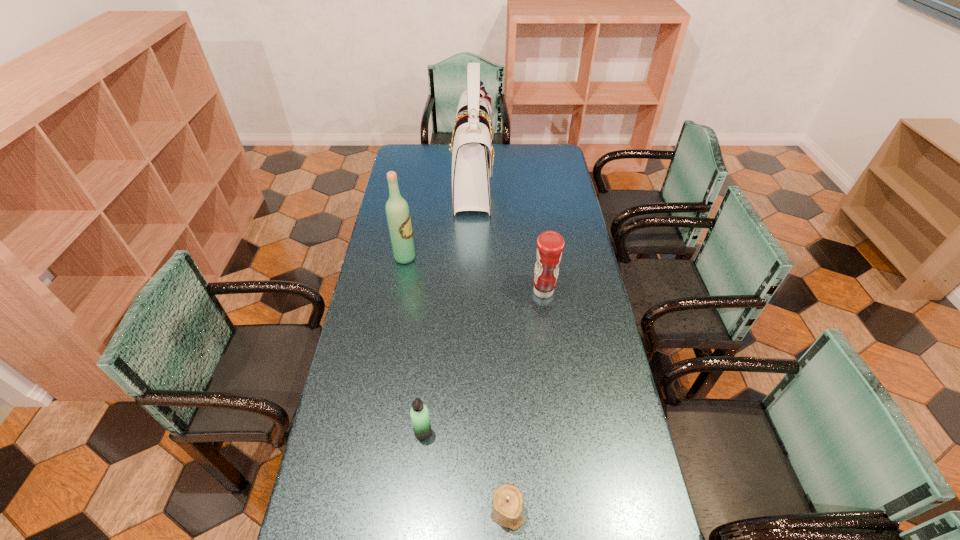
Identify which object is located as the nearest to the thermos bottle. Please provide its 2D coordinates. Your answer should be formatted as a tuple, i.e. [(x, y)], where the tuple contains the x and y coordinates of a point satisfying the conditions above.

[(507, 505)]

Identify which object is the third nearest to the satchel. Please provide its 2D coordinates. Your answer should be formatted as a tuple, i.e. [(x, y)], where the tuple contains the x and y coordinates of a point satisfying the conditions above.

[(419, 414)]

This screenshot has height=540, width=960. What are the coordinates of `free spot that satisfies the following two spatial constraints: 1. on the back side of the rightmost object; 2. on the front-facing side of the farthest object` in the screenshot? It's located at (529, 182).

The image size is (960, 540). Identify the location of free location that satisfies the following two spatial constraints: 1. on the front-facing side of the rightmost object; 2. on the right side of the wine bottle. (399, 292).

This screenshot has height=540, width=960. Identify the location of free space that satisfies the following two spatial constraints: 1. on the back side of the second nearest object; 2. on the front-facing side of the second farthest object. (440, 258).

Locate an element on the screen. This screenshot has height=540, width=960. free space that satisfies the following two spatial constraints: 1. on the front-facing side of the tallest object; 2. on the front side of the fourth tallest object is located at coordinates (468, 432).

The width and height of the screenshot is (960, 540). I want to click on free location that satisfies the following two spatial constraints: 1. on the front-facing side of the nearest object; 2. on the left side of the second farthest object, so click(x=362, y=512).

Image resolution: width=960 pixels, height=540 pixels. What are the coordinates of `vacant space that satisfies the following two spatial constraints: 1. on the front-facing side of the fourth shortest object; 2. on the left side of the second shortest object` in the screenshot? It's located at (375, 432).

The width and height of the screenshot is (960, 540). In order to click on vacant space that satisfies the following two spatial constraints: 1. on the front-facing side of the leftmost object; 2. on the left side of the third nearest object in this screenshot , I will do `click(399, 292)`.

Find the location of a particular element. free space that satisfies the following two spatial constraints: 1. on the front-facing side of the third tallest object; 2. on the left side of the second tallest object is located at coordinates (399, 292).